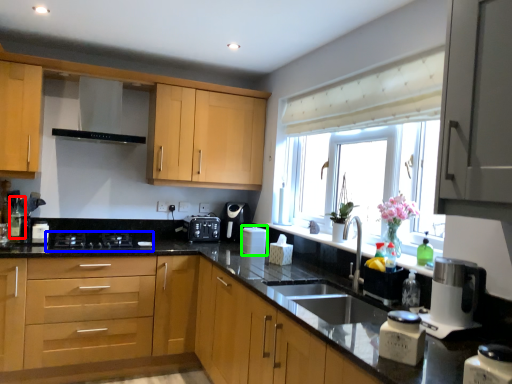
Question: Which object is positioned farthest from bottle (highlighted by a red box)? Select from gas stove (highlighted by a blue box) and appliance (highlighted by a green box).

Choices:
 (A) gas stove
 (B) appliance

Answer: (B)